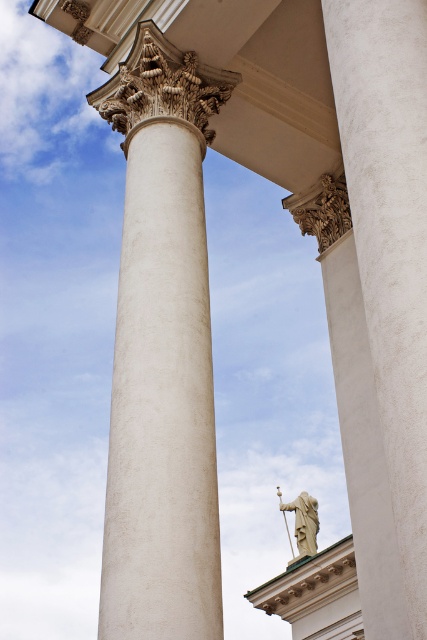
You are an architect planning to install a decorative element between the white marble column at center and the stone statue at center. Given their widths, which object should the decorative element be placed closer to for better visual balance?

The decorative element should be placed closer to the white marble column at center because its width is narrower than the stone statue at center, helping to balance the visual weight between the two objects.

You are standing at the base of the structure and want to take a photo of the white marble column at center. Given that your camera can only focus on objects within a 0.3 radius from the center of the frame, which is at point 0.5, 0.5. Will the column be in focus?

The white marble column at center is located at point (389, 237). The distance between this point and the camera focus center at (213, 320) is sqrt of squared differences, which is sqrt of 0.127 squared plus 0.413 squared. Calculating that gives sqrt of 0.016129 plus 0.170569 equals sqrt of 0.186698, which is approximately 0.432. Since this distance is greater than 0.3, the column will not be in focus.